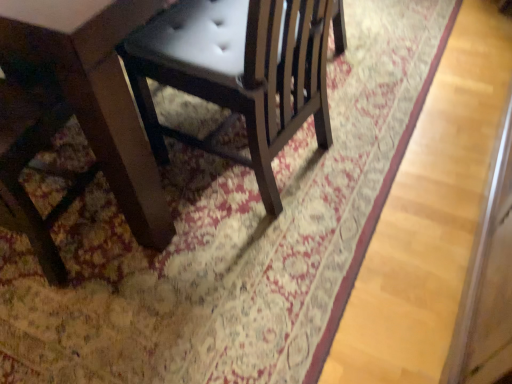
Question: From a real-world perspective, is wooden table at lower left located higher than matte black chair at center?

Choices:
 (A) no
 (B) yes

Answer: (B)

Question: Does wooden table at lower left appear on the left side of matte black chair at center?

Choices:
 (A) no
 (B) yes

Answer: (B)

Question: Considering the relative sizes of wooden table at lower left and matte black chair at center in the image provided, is wooden table at lower left bigger than matte black chair at center?

Choices:
 (A) yes
 (B) no

Answer: (B)

Question: Is wooden table at lower left looking in the opposite direction of matte black chair at center?

Choices:
 (A) no
 (B) yes

Answer: (A)

Question: Does wooden table at lower left have a greater height compared to matte black chair at center?

Choices:
 (A) yes
 (B) no

Answer: (A)

Question: From a real-world perspective, is wooden table at lower left below matte black chair at center?

Choices:
 (A) yes
 (B) no

Answer: (B)

Question: From the image's perspective, is matte black chair at center on wooden table at lower left?

Choices:
 (A) no
 (B) yes

Answer: (B)

Question: Does matte black chair at center turn towards wooden table at lower left?

Choices:
 (A) yes
 (B) no

Answer: (B)

Question: Is matte black chair at center positioned in front of wooden table at lower left?

Choices:
 (A) no
 (B) yes

Answer: (A)

Question: Is matte black chair at center in contact with wooden table at lower left?

Choices:
 (A) no
 (B) yes

Answer: (A)

Question: Is matte black chair at center bigger than wooden table at lower left?

Choices:
 (A) no
 (B) yes

Answer: (B)

Question: From the image's perspective, would you say matte black chair at center is shown under wooden table at lower left?

Choices:
 (A) yes
 (B) no

Answer: (B)

Question: In the image, is matte black chair at center positioned in front of or behind wooden table at lower left?

Choices:
 (A) front
 (B) behind

Answer: (B)